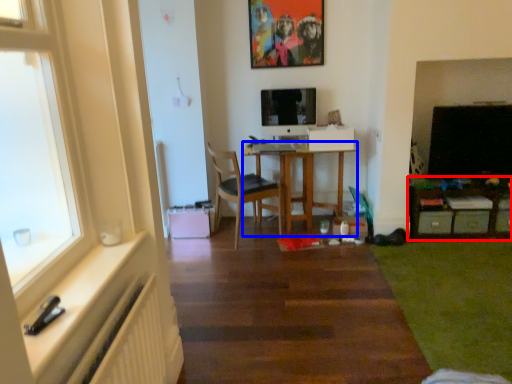
Question: Which object is further to the camera taking this photo, table (highlighted by a red box) or desk (highlighted by a blue box)?

Choices:
 (A) table
 (B) desk

Answer: (B)